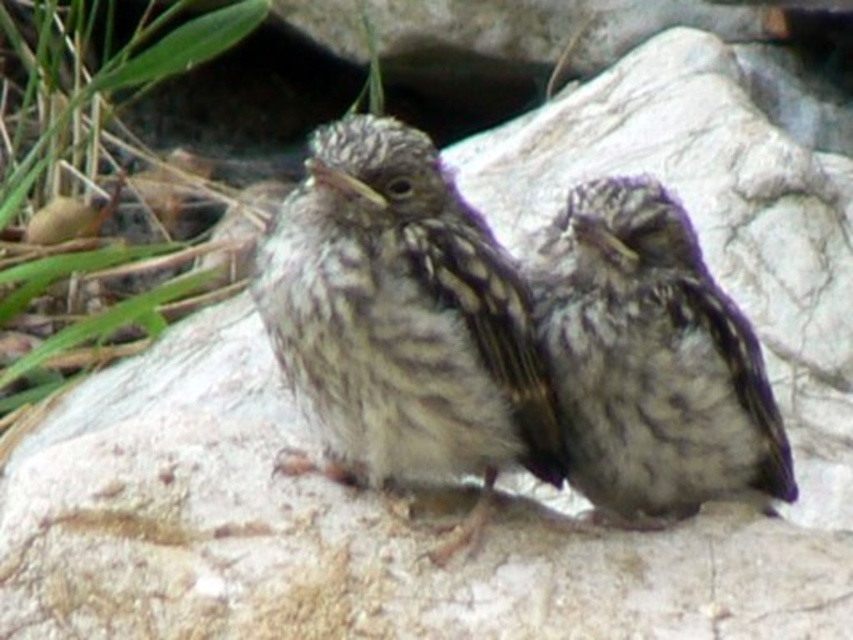
Question: Is the position of brown speckled sparrow at center more distant than that of speckled feathered sparrow at center?

Choices:
 (A) yes
 (B) no

Answer: (B)

Question: Which object appears closest to the camera in this image?

Choices:
 (A) speckled feathered sparrow at center
 (B) brown speckled sparrow at center

Answer: (B)

Question: Considering the relative positions of brown speckled sparrow at center and speckled feathered sparrow at center in the image provided, where is brown speckled sparrow at center located with respect to speckled feathered sparrow at center?

Choices:
 (A) above
 (B) below

Answer: (A)

Question: Is brown speckled sparrow at center closer to camera compared to speckled feathered sparrow at center?

Choices:
 (A) yes
 (B) no

Answer: (A)